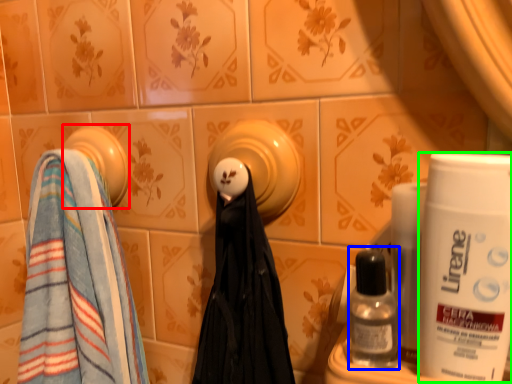
Question: Considering the real-world distances, which object is farthest from towel (highlighted by a red box)? mouthwash (highlighted by a blue box) or shaving cream (highlighted by a green box)?

Choices:
 (A) mouthwash
 (B) shaving cream

Answer: (B)